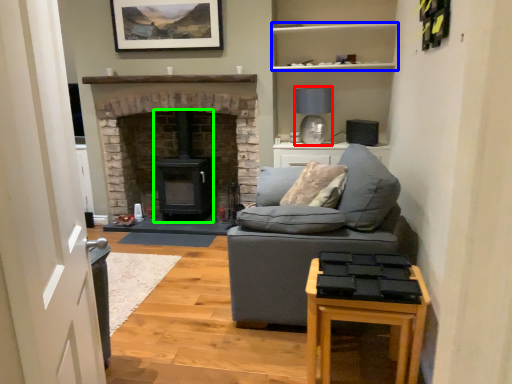
Question: Which object is the farthest from lamp (highlighted by a red box)? Choose among these: shelf (highlighted by a blue box) or wood burning stove (highlighted by a green box).

Choices:
 (A) shelf
 (B) wood burning stove

Answer: (B)